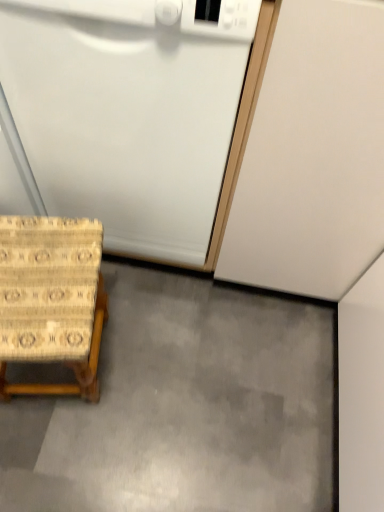
The width and height of the screenshot is (384, 512). I want to click on blank space situated above gray smooth concrete at lower center (from a real-world perspective), so click(196, 400).